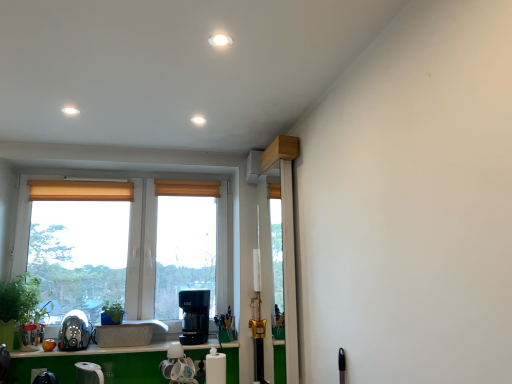
Question: Is black plastic coffee machine at lower center, which is counted as the 1th coffee machine, starting from the right, in front of or behind matte glass window at center in the image?

Choices:
 (A) front
 (B) behind

Answer: (A)

Question: Looking at their shapes, would you say black plastic coffee machine at lower center, positioned as the second coffee machine in left-to-right order, is wider or thinner than matte glass window at center?

Choices:
 (A) wide
 (B) thin

Answer: (A)

Question: Which object is positioned closest to the matte yellow curtain at left, arranged as the second curtain when viewed from the right?

Choices:
 (A) matte glass window at center
 (B) white glossy coffee maker at lower center, which is the 2th appliance in right-to-left order
 (C) satin silver coffee machine at lower left, which appears as the second coffee machine when viewed from the right
 (D) white glossy paper towel holder at center, positioned as the 2th appliance in left-to-right order
 (E) clear plastic screen door at center

Answer: (A)

Question: Considering the real-world distances, which object is farthest from the black plastic coffee machine at lower center, which is counted as the 1th coffee machine, starting from the right?

Choices:
 (A) clear plastic screen door at center
 (B) satin silver coffee machine at lower left, positioned as the first coffee machine in left-to-right order
 (C) white glossy paper towel holder at center, which appears as the first appliance when viewed from the right
 (D) orange fabric curtain at center, which appears as the 1th curtain when viewed from the right
 (E) green matte plant at center, which ranks as the first plant in right-to-left order

Answer: (A)